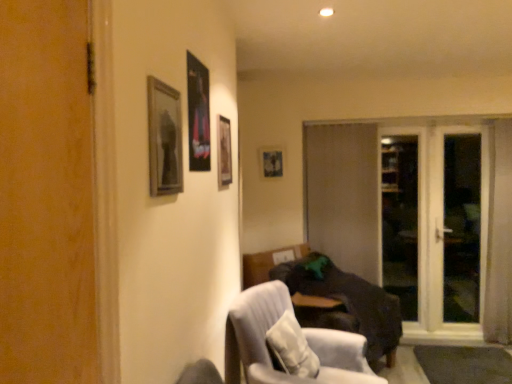
Locate an element on the screen. The image size is (512, 384). transparent glass screen door at right, which is the first screen door in right-to-left order is located at coordinates (400, 220).

Measure the distance between point (304,320) and camera.

Point (304,320) is 3.16 meters from camera.

In order to face brown matte door at center, should I rotate leftwards or rightwards?

A 11.874 degree turn to the right will do.

This screenshot has width=512, height=384. What do you see at coordinates (344, 195) in the screenshot?
I see `brown matte door at center` at bounding box center [344, 195].

At what (x,y) coordinates should I click in order to perform the action: click on transparent glass screen door at right, which ranks as the 2th screen door in right-to-left order. Please return your answer as a coordinate pair (x, y). This screenshot has height=384, width=512. Looking at the image, I should click on (435, 226).

Is wooden picture frame at center, positioned as the 1th picture frame in back-to-front order, beside transparent glass screen door at right, which is the first screen door in right-to-left order?

No, wooden picture frame at center, positioned as the 1th picture frame in back-to-front order, is not making contact with transparent glass screen door at right, which is the first screen door in right-to-left order.

From the picture: What's the angular difference between wooden picture frame at center, arranged as the first picture frame when viewed from the right, and transparent glass screen door at right, placed as the 2th screen door when sorted from left to right,'s facing directions?

wooden picture frame at center, arranged as the first picture frame when viewed from the right, and transparent glass screen door at right, placed as the 2th screen door when sorted from left to right, are facing 0.0394 degrees away from each other.

From the image's perspective, who appears lower, wooden picture frame at center, positioned as the 1th picture frame in back-to-front order, or transparent glass screen door at right, placed as the 2th screen door when sorted from left to right?

From the image's view, transparent glass screen door at right, placed as the 2th screen door when sorted from left to right, is below.

Considering the relative sizes of wooden picture frame at center, which is the 4th picture frame in front-to-back order, and transparent glass screen door at right, which is the first screen door in right-to-left order, in the image provided, is wooden picture frame at center, which is the 4th picture frame in front-to-back order, taller than transparent glass screen door at right, which is the first screen door in right-to-left order,?

Incorrect, the height of wooden picture frame at center, which is the 4th picture frame in front-to-back order, is not larger of that of transparent glass screen door at right, which is the first screen door in right-to-left order.

Is point (423, 278) positioned before point (153, 77)?

No, it is not.

Identify the location of screen door that is the 2nd object directly below the wooden frame at upper left, the first picture frame positioned from the front (from a real-world perspective). (435, 226).

What's the angular difference between transparent glass screen door at right, which ranks as the 2th screen door in right-to-left order, and wooden frame at upper left, which is the 1th picture frame in left-to-right order,'s facing directions?

The facing directions of transparent glass screen door at right, which ranks as the 2th screen door in right-to-left order, and wooden frame at upper left, which is the 1th picture frame in left-to-right order, are 90 degrees apart.

Which object is thinner, transparent glass screen door at right, which ranks as the 2th screen door in right-to-left order, or wooden frame at upper left, which is the 1th picture frame in left-to-right order?

wooden frame at upper left, which is the 1th picture frame in left-to-right order, is thinner.

Which of these two, transparent glass screen door at right, which is the first screen door in right-to-left order, or dark brown fabric couch at lower right, is smaller?

With smaller size is transparent glass screen door at right, which is the first screen door in right-to-left order.

In the scene shown: Can we say transparent glass screen door at right, which is the first screen door in right-to-left order, lies outside dark brown fabric couch at lower right?

Indeed, transparent glass screen door at right, which is the first screen door in right-to-left order, is completely outside dark brown fabric couch at lower right.

From a real-world perspective, is transparent glass screen door at right, which is the first screen door in right-to-left order, physically above dark brown fabric couch at lower right?

Correct, in the physical world, transparent glass screen door at right, which is the first screen door in right-to-left order, is higher than dark brown fabric couch at lower right.

Is point (385, 267) positioned before point (362, 289)?

That is False.

Looking at this image, is light gray fabric chair at lower center to the left or to the right of transparent glass screen door at right, the 1th screen door when ordered from left to right, in the image?

light gray fabric chair at lower center is to the left of transparent glass screen door at right, the 1th screen door when ordered from left to right.

Considering the positions of point (226, 370) and point (446, 315), is point (226, 370) closer or farther from the camera than point (446, 315)?

Point (226, 370) is positioned closer to the camera compared to point (446, 315).

From a real-world perspective, who is located lower, light gray fabric chair at lower center or transparent glass screen door at right, which ranks as the 2th screen door in right-to-left order?

light gray fabric chair at lower center.

Is light gray fabric chair at lower center positioned beyond the bounds of transparent glass screen door at right, the 1th screen door when ordered from left to right?

Indeed, light gray fabric chair at lower center is completely outside transparent glass screen door at right, the 1th screen door when ordered from left to right.

Is brown matte door at center not close to transparent glass screen door at right, which is the first screen door in right-to-left order?

Yes, brown matte door at center and transparent glass screen door at right, which is the first screen door in right-to-left order, are located far from each other.

From a real-world perspective, does brown matte door at center sit lower than transparent glass screen door at right, placed as the 2th screen door when sorted from left to right?

Actually, brown matte door at center is physically above transparent glass screen door at right, placed as the 2th screen door when sorted from left to right, in the real world.

Does brown matte door at center have a greater width compared to transparent glass screen door at right, which is the first screen door in right-to-left order?

Yes, brown matte door at center is wider than transparent glass screen door at right, which is the first screen door in right-to-left order.

Considering the points (344, 222) and (417, 278), which point is behind, point (344, 222) or point (417, 278)?

The point (417, 278) is behind.

Which is more to the left, dark brown fabric couch at lower right or white textured pillow at lower center?

white textured pillow at lower center is more to the left.

Is dark brown fabric couch at lower right shorter than white textured pillow at lower center?

No, dark brown fabric couch at lower right is not shorter than white textured pillow at lower center.

Do you think dark brown fabric couch at lower right is within white textured pillow at lower center, or outside of it?

dark brown fabric couch at lower right cannot be found inside white textured pillow at lower center.

Between transparent glass screen door at right, which is the first screen door in right-to-left order, and light gray fabric chair at lower center, which one has larger width?

With larger width is light gray fabric chair at lower center.

Based on the photo, which object is more forward, transparent glass screen door at right, placed as the 2th screen door when sorted from left to right, or light gray fabric chair at lower center?

Positioned in front is light gray fabric chair at lower center.

Is transparent glass screen door at right, which is the first screen door in right-to-left order, far away from light gray fabric chair at lower center?

Yes, transparent glass screen door at right, which is the first screen door in right-to-left order, and light gray fabric chair at lower center are quite far apart.

The height and width of the screenshot is (384, 512). What are the coordinates of `the 3rd picture frame above when counting from the transparent glass screen door at right, placed as the 2th screen door when sorted from left to right (from the image's perspective)` in the screenshot? It's located at (271, 161).

At what (x,y) coordinates should I click in order to perform the action: click on picture frame that is the 3rd object above the transparent glass screen door at right, which ranks as the 2th screen door in right-to-left order (from a real-world perspective). Please return your answer as a coordinate pair (x, y). This screenshot has width=512, height=384. Looking at the image, I should click on (164, 138).

Which object lies further to the anchor point wooden frame at upper left, which is the 1th picture frame in left-to-right order, transparent glass screen door at right, which ranks as the 2th screen door in right-to-left order, or brown matte door at center?

transparent glass screen door at right, which ranks as the 2th screen door in right-to-left order, is positioned further to the anchor wooden frame at upper left, which is the 1th picture frame in left-to-right order.

Considering their positions, is brown matte door at center positioned further to wooden frame at upper center, which is the 2th picture frame from back to front, than light gray fabric chair at lower center?

The object further to wooden frame at upper center, which is the 2th picture frame from back to front, is brown matte door at center.

When comparing their distances from brown matte door at center, does transparent glass screen door at right, which ranks as the 2th screen door in right-to-left order, or metallic poster at upper center, the third picture frame in the back-to-front sequence, seem closer?

Among the two, transparent glass screen door at right, which ranks as the 2th screen door in right-to-left order, is located nearer to brown matte door at center.

From the image, which object appears to be farther from wooden frame at upper center, which is the 2th picture frame from back to front, light gray fabric chair at lower center or brown matte door at center?

brown matte door at center lies further to wooden frame at upper center, which is the 2th picture frame from back to front, than the other object.

Considering their positions, is brown matte door at center positioned closer to transparent glass screen door at right, which is the first screen door in right-to-left order, than wooden frame at upper left, which is the 1th picture frame in left-to-right order?

The object closer to transparent glass screen door at right, which is the first screen door in right-to-left order, is brown matte door at center.

Estimate the real-world distances between objects in this image. Which object is further from white textured pillow at lower center, light gray fabric chair at lower center or wooden frame at upper left, which ranks as the fourth picture frame in back-to-front order?

wooden frame at upper left, which ranks as the fourth picture frame in back-to-front order, lies further to white textured pillow at lower center than the other object.

Based on their spatial positions, is wooden frame at upper center, marked as the second picture frame in a right-to-left arrangement, or white textured pillow at lower center closer to brown matte door at center?

Based on the image, white textured pillow at lower center appears to be nearer to brown matte door at center.

Estimate the real-world distances between objects in this image. Which object is further from wooden frame at upper center, which is the 2th picture frame from back to front, wooden picture frame at center, positioned as the 1th picture frame in back-to-front order, or dark brown fabric couch at lower right?

wooden picture frame at center, positioned as the 1th picture frame in back-to-front order.

Image resolution: width=512 pixels, height=384 pixels. Identify the location of screen door between white textured pillow at lower center and brown matte door at center along the z-axis. (435, 226).

Where is `picture frame positioned between wooden frame at upper left, which is the 1th picture frame in left-to-right order, and wooden frame at upper center, which is the 3th picture frame from left to right, from near to far`? picture frame positioned between wooden frame at upper left, which is the 1th picture frame in left-to-right order, and wooden frame at upper center, which is the 3th picture frame from left to right, from near to far is located at coordinates (198, 114).

Locate an element on the screen. studio couch between light gray fabric chair at lower center and brown matte door at center along the z-axis is located at coordinates (345, 304).

In order to click on studio couch between white textured pillow at lower center and brown matte door at center along the z-axis in this screenshot , I will do `click(345, 304)`.